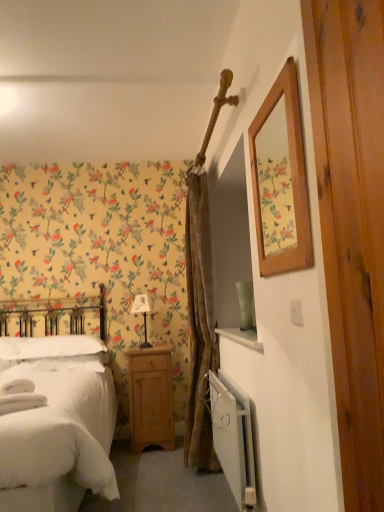
Question: Is white soft pillow at left in front of or behind light brown wood nightstand at lower center in the image?

Choices:
 (A) front
 (B) behind

Answer: (A)

Question: From the image's perspective, is white soft pillow at left located above or below light brown wood nightstand at lower center?

Choices:
 (A) below
 (B) above

Answer: (B)

Question: Considering the real-world distances, which object is closest to the white soft bed at left?

Choices:
 (A) brown textured curtain at center
 (B) white metallic radiator at lower right
 (C) white fabric lampshade at center
 (D) white soft pillow at left
 (E) light brown wood nightstand at lower center

Answer: (D)

Question: Which of these objects is positioned farthest from the brown textured curtain at center?

Choices:
 (A) white metallic radiator at lower right
 (B) white fabric lampshade at center
 (C) white soft bed at left
 (D) light brown wood nightstand at lower center
 (E) white soft pillow at left

Answer: (E)